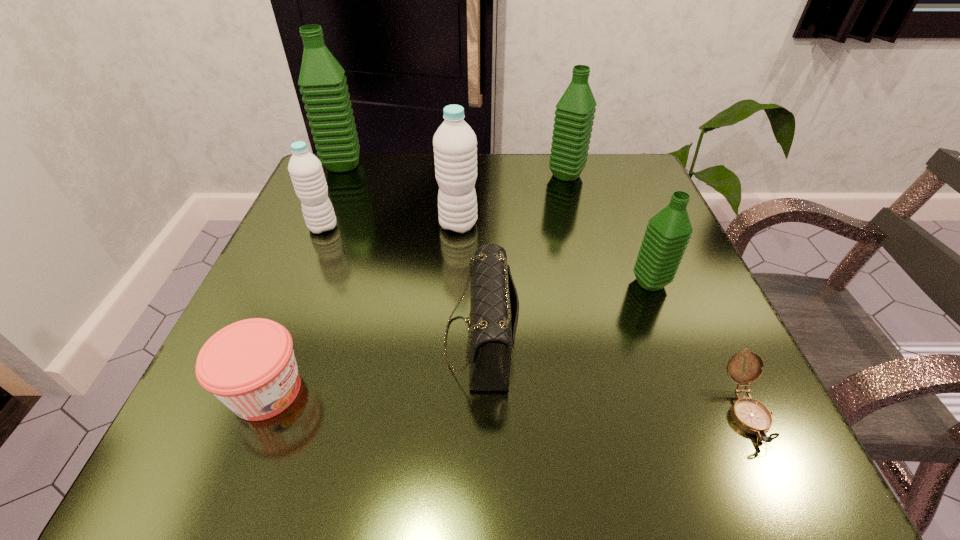
The image size is (960, 540). What are the coordinates of `vacant area that lies between the smallest green water bottle and the second green water bottle from right to left` in the screenshot? It's located at point(608,229).

The image size is (960, 540). What are the coordinates of `vacant area between the sixth tallest object and the compass` in the screenshot? It's located at coord(613,376).

Find the location of a particular element. The image size is (960, 540). vacant space in between the third water bottle from left to right and the clutch bag is located at coordinates (469, 282).

In order to click on free space between the clutch bag and the second smallest green water bottle in this screenshot , I will do `click(523, 258)`.

Where is `free space between the right white water bottle and the smaller white water bottle`? free space between the right white water bottle and the smaller white water bottle is located at coordinates (391, 226).

Locate an element on the screen. vacant area between the compass and the tallest object is located at coordinates (544, 288).

This screenshot has height=540, width=960. Find the location of `vacant point located between the sixth tallest object and the smaller white water bottle`. vacant point located between the sixth tallest object and the smaller white water bottle is located at coordinates (401, 284).

Select which object appears as the seventh closest to the clutch bag. Please provide its 2D coordinates. Your answer should be formatted as a tuple, i.e. [(x, y)], where the tuple contains the x and y coordinates of a point satisfying the conditions above.

[(325, 93)]

Identify which object is located as the sixth nearest to the sixth object from left to right. Please provide its 2D coordinates. Your answer should be formatted as a tuple, i.e. [(x, y)], where the tuple contains the x and y coordinates of a point satisfying the conditions above.

[(750, 415)]

Where is `water bottle that stands as the fifth closest to the compass`? water bottle that stands as the fifth closest to the compass is located at coordinates (325, 93).